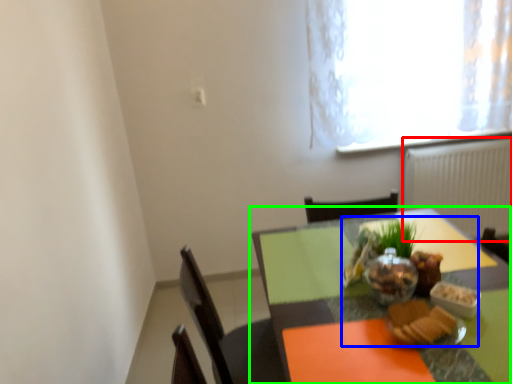
Question: Which object is positioned farthest from radiator (highlighted by a red box)? Select from meal (highlighted by a blue box) and table (highlighted by a green box).

Choices:
 (A) meal
 (B) table

Answer: (A)